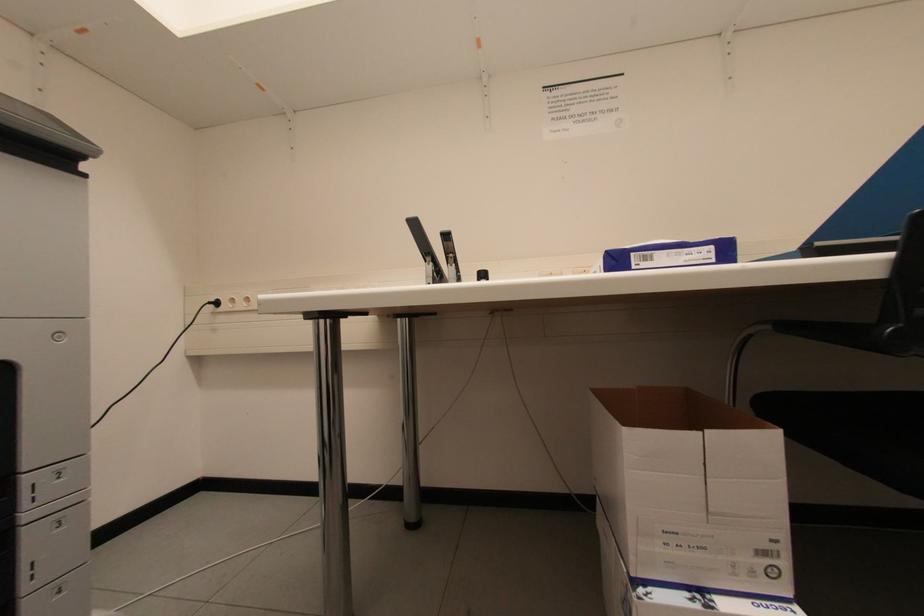
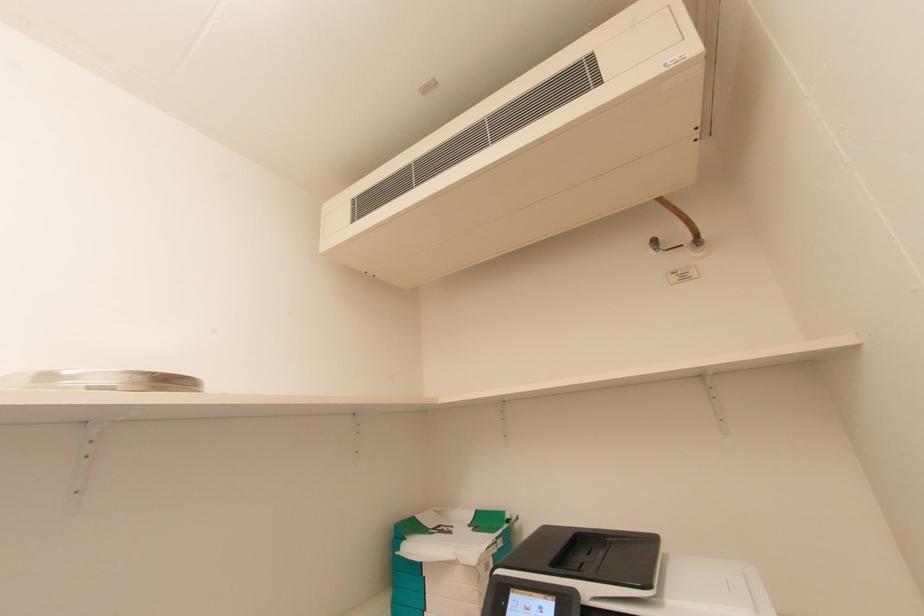
Based on the continuous images, in which direction is the camera rotating?

The rotation direction of the camera is right-up.